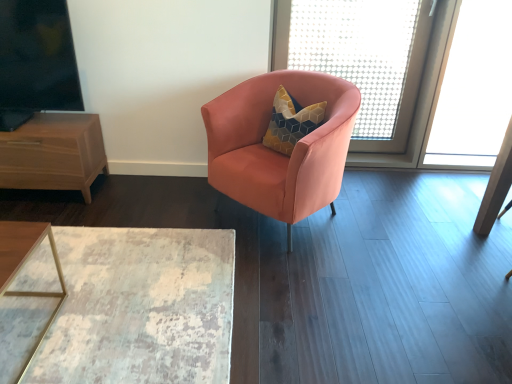
Question: Is translucent mesh screen at upper right, acting as the 1th window screen starting from the right, wider or thinner than distressed wood table at lower left?

Choices:
 (A) wide
 (B) thin

Answer: (B)

Question: Choose the correct answer: Is translucent mesh screen at upper right, which ranks as the first window screen in back-to-front order, inside distressed wood table at lower left or outside it?

Choices:
 (A) inside
 (B) outside

Answer: (B)

Question: Based on their relative distances, which object is nearer to the black glass window screen at upper left, acting as the 1th window screen starting from the left?

Choices:
 (A) translucent mesh screen at upper right, which ranks as the first window screen in back-to-front order
 (B) satin peach armchair at center
 (C) brown wood nightstand at left
 (D) distressed wood table at lower left

Answer: (C)

Question: Estimate the real-world distances between objects in this image. Which object is farther from the distressed wood table at lower left?

Choices:
 (A) satin peach armchair at center
 (B) black glass window screen at upper left, which is the second window screen from right to left
 (C) translucent mesh screen at upper right, which is counted as the 2th window screen, starting from the front
 (D) brown wood nightstand at left

Answer: (C)